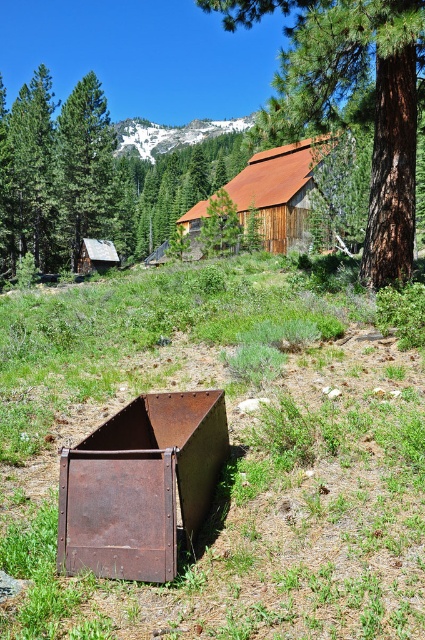
You are standing at the point marked at coordinates (231, 456) in the image. Based on the scene described, what object are you standing on?

The point at coordinates (231, 456) is on the rusty metal container at lower left, so you are standing on the rusty metal container at lower left.

You are standing at the camera position and want to pick up the rusty metal container at lower left. Can you reach it without moving your feet?

The rusty metal container at lower left is 8.03 feet away from the camera. Since the average human arm length is about 2.5 feet, you cannot reach it without moving your feet.

You are standing at the base of the hill where the rusty metal box at lower center is located. You want to climb up to the brown rough bark tree at upper center. Is the tree taller than the box?

The rusty metal box at lower center is shorter than the brown rough bark tree at upper center, so yes, the tree is taller than the box.